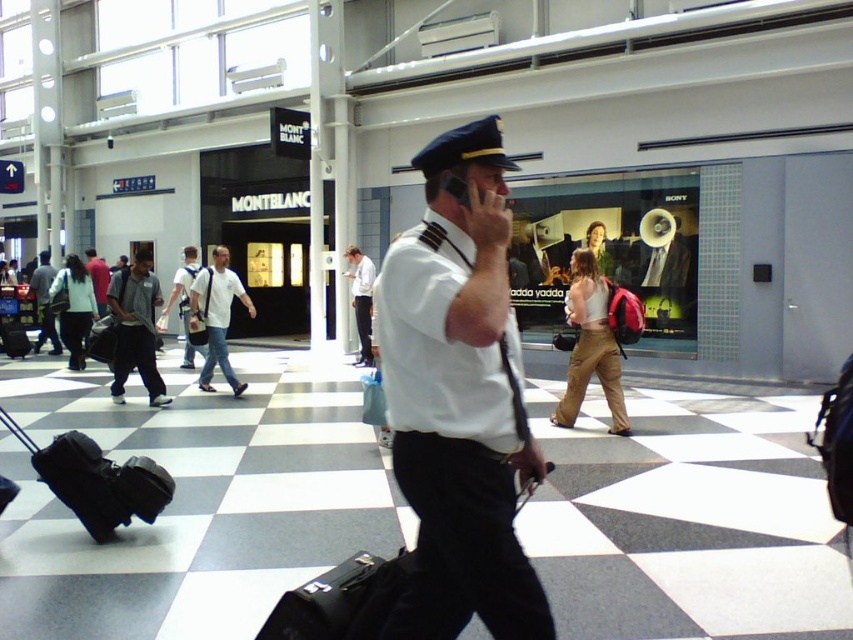
Question: Which of the following is the farthest from the observer?

Choices:
 (A) (x=22, y=436)
 (B) (x=605, y=388)
 (C) (x=119, y=285)
 (D) (x=354, y=568)

Answer: (C)

Question: Does white cotton shirt at center have a greater width compared to light blue denim jeans at center?

Choices:
 (A) no
 (B) yes

Answer: (B)

Question: Which point is farther to the camera?

Choices:
 (A) black matte suitcase at lower left
 (B) matte white uniform at center
 (C) dark gray uniform at center
 (D) white fabric shirt at center

Answer: (B)

Question: Which point is closer to the camera?

Choices:
 (A) black leather suitcase at center
 (B) black matte suitcase at lower left
 (C) matte black backpack at left

Answer: (A)

Question: Observing the image, what is the correct spatial positioning of white uniform at center in reference to light brown leather backpack at center?

Choices:
 (A) above
 (B) below

Answer: (B)

Question: Is matte black backpack at left positioned before white fabric shirt at center?

Choices:
 (A) yes
 (B) no

Answer: (B)